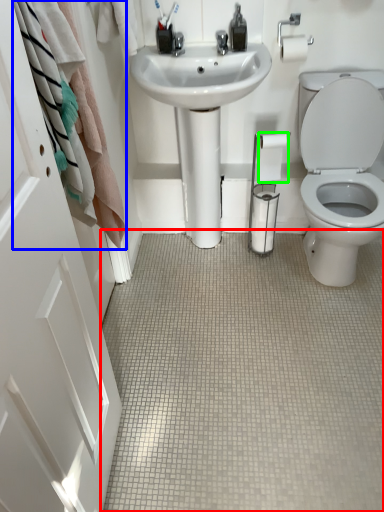
Question: Considering the real-world distances, which object is farthest from plain (highlighted by a red box)? bath towel (highlighted by a blue box) or toilet paper (highlighted by a green box)?

Choices:
 (A) bath towel
 (B) toilet paper

Answer: (B)